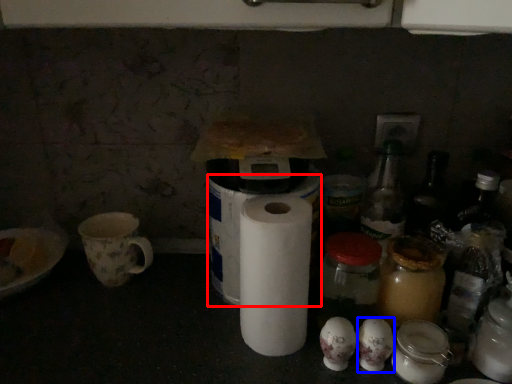
Question: Which point is further to the camera, toilet paper (highlighted by a red box) or toilet paper (highlighted by a blue box)?

Choices:
 (A) toilet paper
 (B) toilet paper

Answer: (A)